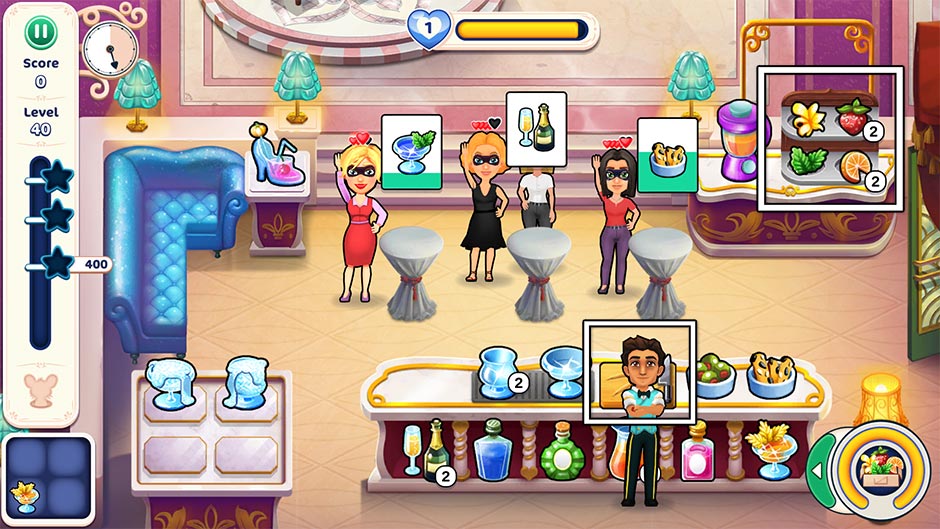
At what (x,y) coordinates should I click in order to perform the action: click on bowl of olives. Please return your answer as a coordinate pair (x, y). The image size is (940, 529). Looking at the image, I should click on (710, 360).